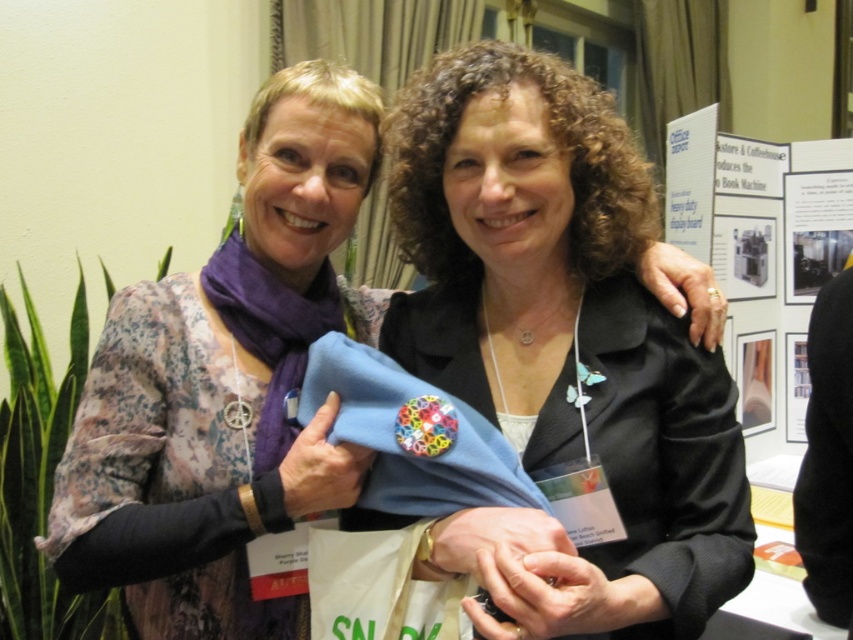
Does black matte blazer at center appear under blue fabric at center?

No, black matte blazer at center is not below blue fabric at center.

Which is below, black matte blazer at center or blue fabric at center?

Positioned lower is blue fabric at center.

Is point (689, 522) more distant than point (316, 116)?

No, it is in front of (316, 116).

Where is `black matte blazer at center`? The height and width of the screenshot is (640, 853). black matte blazer at center is located at coordinates (561, 349).